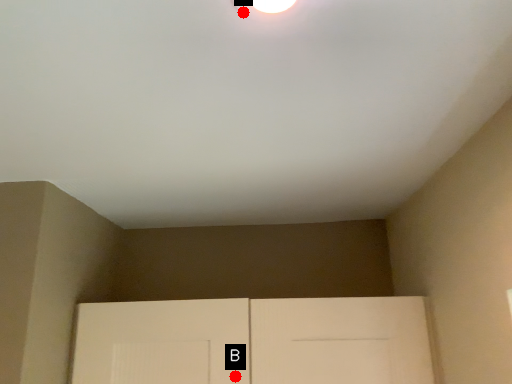
Question: Two points are circled on the image, labeled by A and B beside each circle. Which of the following is the farthest from the observer?

Choices:
 (A) A is further
 (B) B is further

Answer: (B)